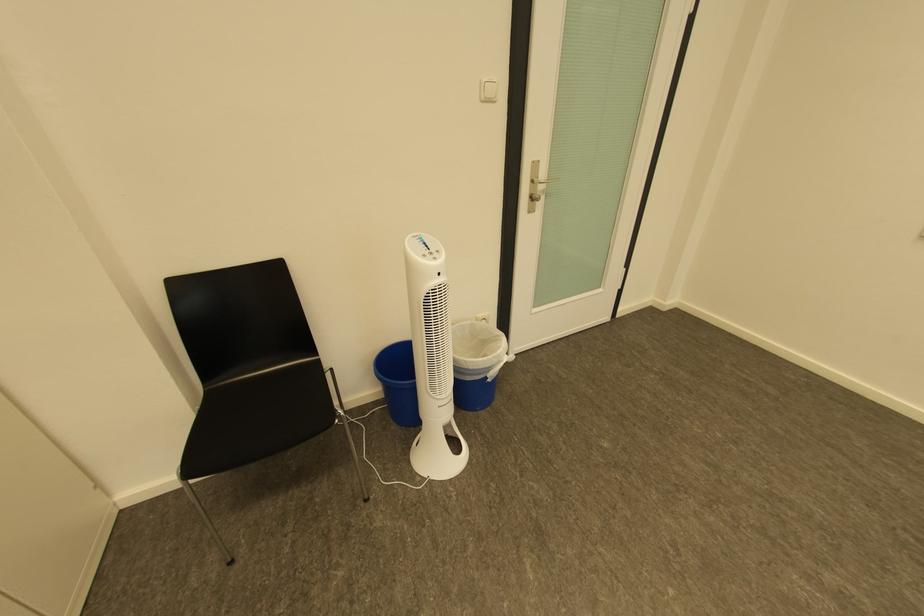
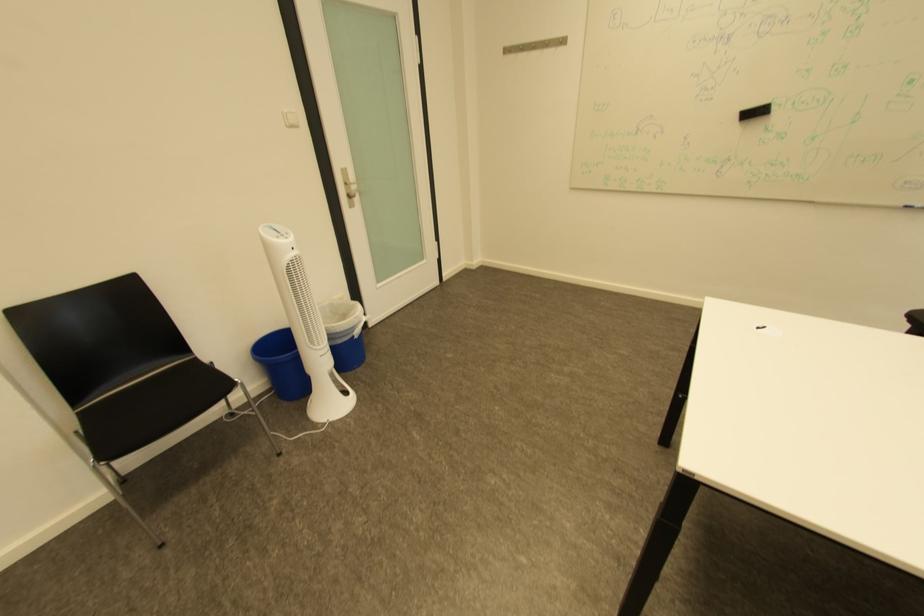
Question: In a continuous first-person perspective shot, in which direction is the camera moving?

Choices:
 (A) Left
 (B) Right
 (C) Forward
 (D) Backward

Answer: (D)